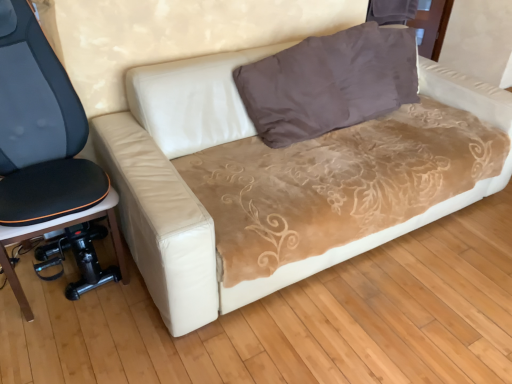
Locate an element on the screen. vacant area that is in front of black fabric office chair at left is located at coordinates (71, 346).